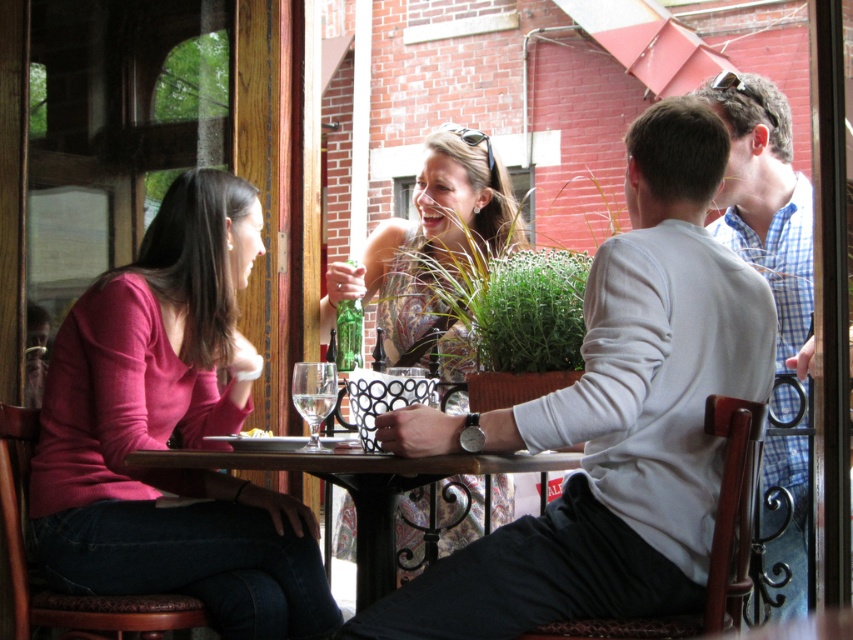
Which of these two, light gray sweater at center or clear glass wine glass at table center, stands shorter?

With less height is clear glass wine glass at table center.

Can you confirm if light gray sweater at center is shorter than clear glass wine glass at table center?

No, light gray sweater at center is not shorter than clear glass wine glass at table center.

Describe the element at coordinates (612, 419) in the screenshot. I see `light gray sweater at center` at that location.

The width and height of the screenshot is (853, 640). Find the location of `light gray sweater at center`. light gray sweater at center is located at coordinates (612, 419).

Is wooden table at center below clear glass wine glass at table center?

Correct, wooden table at center is located below clear glass wine glass at table center.

Does point (363, 470) come behind point (308, 388)?

No, (363, 470) is closer to viewer.

Between point (450, 461) and point (312, 396), which one is positioned behind?

Positioned behind is point (312, 396).

Image resolution: width=853 pixels, height=640 pixels. I want to click on wooden table at center, so click(x=364, y=488).

Can you confirm if patterned fabric dress at center is thinner than clear glass wine glass at table center?

No, patterned fabric dress at center is not thinner than clear glass wine glass at table center.

Is point (419, 321) in front of point (332, 390)?

No, it is not.

Identify the location of patterned fabric dress at center. (432, 248).